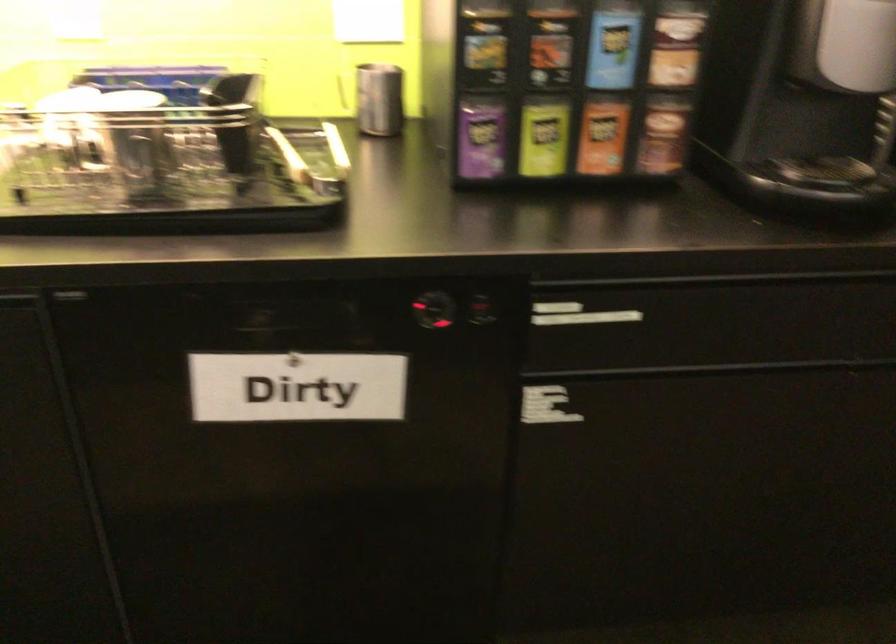
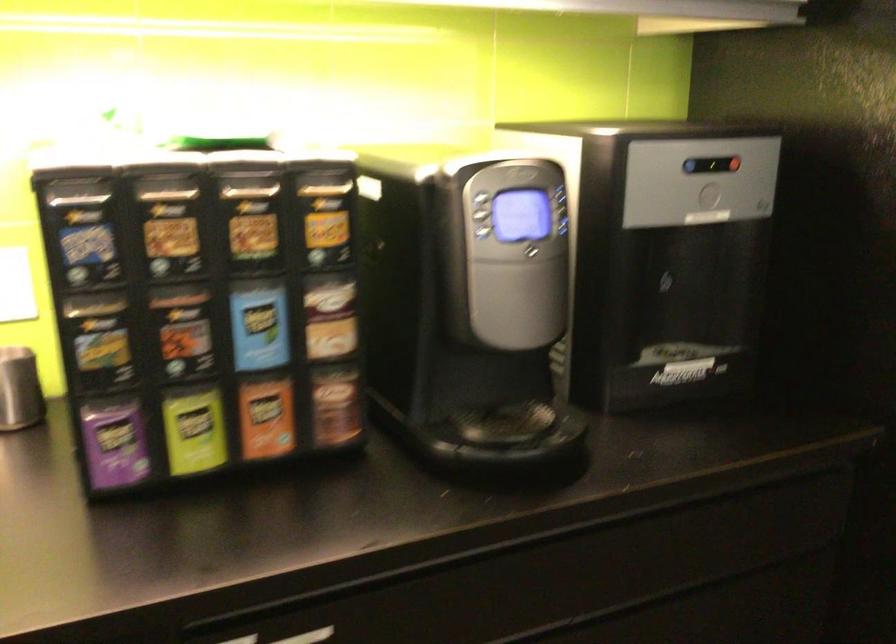
The point at (x=390, y=100) is marked in the first image. Where is the corresponding point in the second image?

(19, 389)